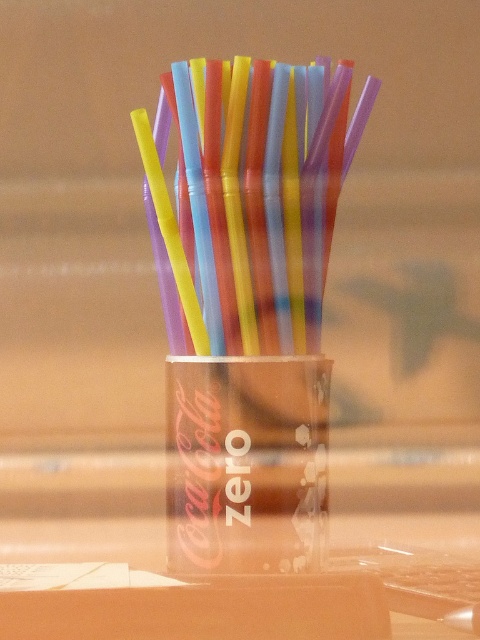
Between point (229, 212) and point (287, 474), which one is positioned in front?

Point (229, 212) is in front.

Does translucent plastic straws at center have a greater width compared to transparent plastic cup at center?

Indeed, translucent plastic straws at center has a greater width compared to transparent plastic cup at center.

This screenshot has width=480, height=640. Find the location of `translucent plastic straws at center`. translucent plastic straws at center is located at coordinates (255, 198).